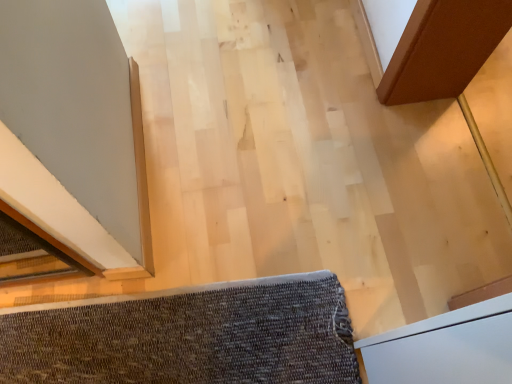
What do you see at coordinates (188, 336) in the screenshot?
I see `textured gray mat at lower left` at bounding box center [188, 336].

Where is `textured gray mat at lower left`? textured gray mat at lower left is located at coordinates click(188, 336).

Looking at this image, measure the distance between point (304, 313) and camera.

4.20 feet.

The height and width of the screenshot is (384, 512). Find the location of `textured gray mat at lower left`. textured gray mat at lower left is located at coordinates (188, 336).